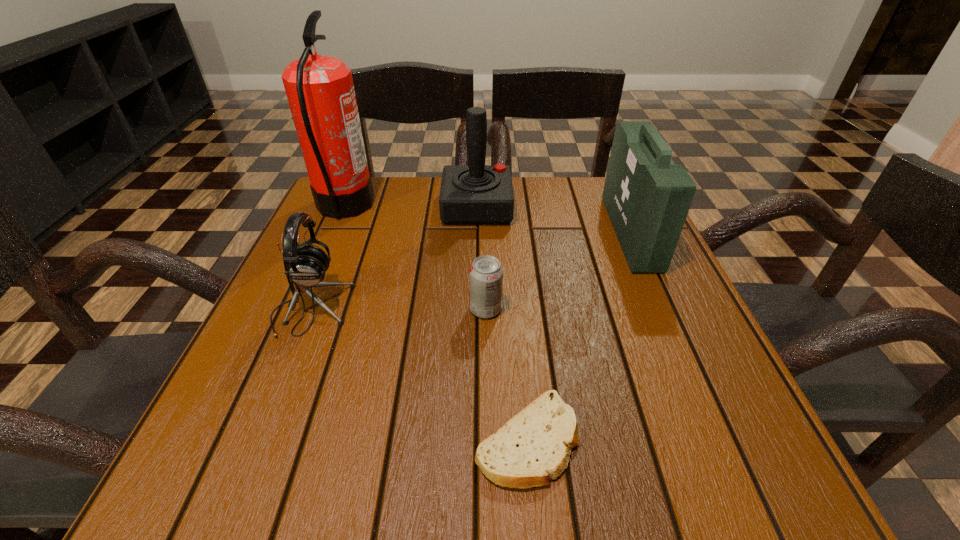
You are a GUI agent. You are given a task and a screenshot of the screen. Output one action in this format:
    pyautogui.click(x=<x>, y=<y>)
    Task: Click on the earphone located in the left edge section of the desktop
    The image size is (960, 540).
    Given the screenshot: What is the action you would take?
    pyautogui.click(x=306, y=264)

Image resolution: width=960 pixels, height=540 pixels. I want to click on object positioned at the right edge, so click(647, 197).

Find the location of a particular element. object present at the far left corner is located at coordinates (320, 91).

At what (x,y) coordinates should I click in order to perform the action: click on object at the far right corner. Please return your answer as a coordinate pair (x, y). Image resolution: width=960 pixels, height=540 pixels. Looking at the image, I should click on (647, 197).

Locate an element on the screen. vacant space at the far edge is located at coordinates (571, 197).

Locate an element on the screen. vacant area at the near edge is located at coordinates (369, 444).

Locate an element on the screen. vacant space at the left edge of the desktop is located at coordinates (343, 233).

You are a GUI agent. You are given a task and a screenshot of the screen. Output one action in this format:
    pyautogui.click(x=<x>, y=<y>)
    Task: Click on the vacant region at the right edge of the desktop
    Image resolution: width=960 pixels, height=540 pixels.
    Given the screenshot: What is the action you would take?
    pyautogui.click(x=702, y=353)

At what (x,y) coordinates should I click in order to perform the action: click on free space at the far left corner. Please return your answer as a coordinate pair (x, y). The height and width of the screenshot is (540, 960). Looking at the image, I should click on (383, 192).

Locate an element on the screen. Image resolution: width=960 pixels, height=540 pixels. vacant area at the near left corner is located at coordinates (240, 463).